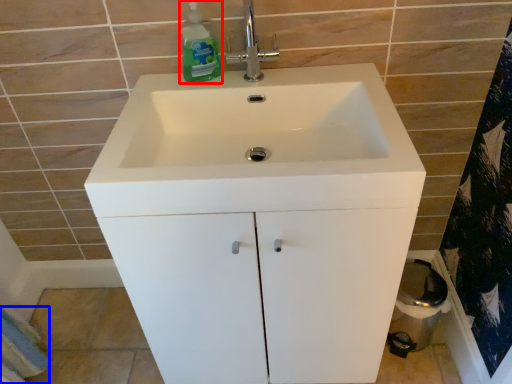
Question: Among these objects, which one is farthest to the camera, cleaning product (highlighted by a red box) or bath towel (highlighted by a blue box)?

Choices:
 (A) cleaning product
 (B) bath towel

Answer: (B)